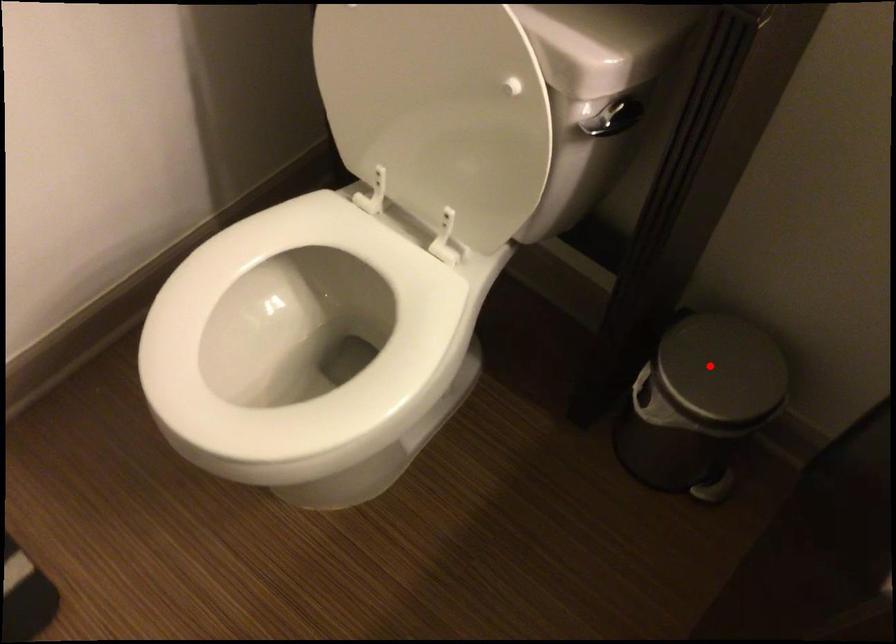
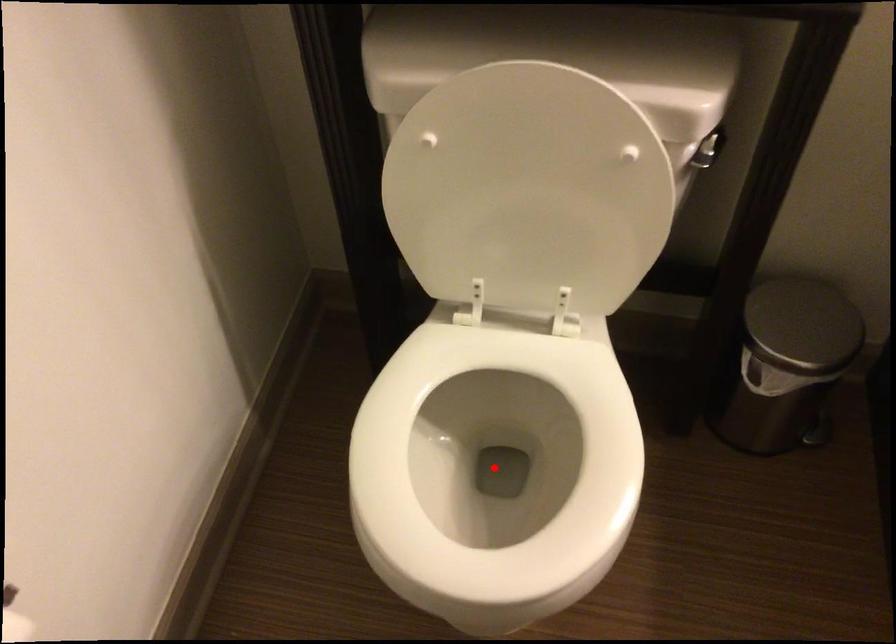
I am providing you with two images of the same scene from different viewpoints. A red point is marked on the first image and another point is marked on the second image. Do the highlighted points in image1 and image2 indicate the same real-world spot?

No